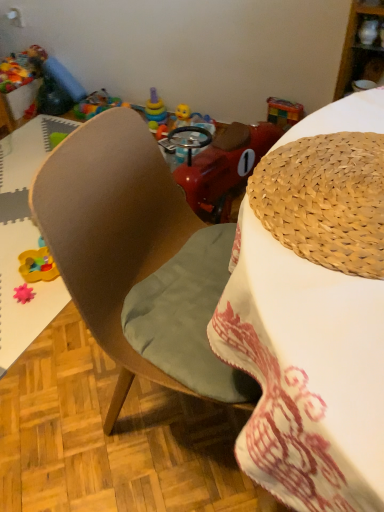
Question: From a real-world perspective, does translucent plastic sippy cup at center, acting as the 1th toy starting from the right, sit lower than woven straw hat at upper right?

Choices:
 (A) yes
 (B) no

Answer: (A)

Question: Does translucent plastic sippy cup at center, the second toy in the top-to-bottom sequence, have a smaller size compared to woven straw hat at upper right?

Choices:
 (A) no
 (B) yes

Answer: (B)

Question: From the image's perspective, is translucent plastic sippy cup at center, positioned as the second toy in front-to-back order, under woven straw hat at upper right?

Choices:
 (A) no
 (B) yes

Answer: (A)

Question: Could woven straw hat at upper right be considered to be inside translucent plastic sippy cup at center, the second toy in the top-to-bottom sequence?

Choices:
 (A) no
 (B) yes

Answer: (A)

Question: From a real-world perspective, is translucent plastic sippy cup at center, the second toy in the top-to-bottom sequence, located higher than woven straw hat at upper right?

Choices:
 (A) yes
 (B) no

Answer: (B)

Question: Is translucent plastic sippy cup at center, positioned as the second toy in front-to-back order, outside of woven straw hat at upper right?

Choices:
 (A) no
 (B) yes

Answer: (B)

Question: From a real-world perspective, is translucent plastic sippy cup at center, the second toy in the top-to-bottom sequence, physically below wooden cabinet at upper right?

Choices:
 (A) no
 (B) yes

Answer: (B)

Question: From the image's perspective, does translucent plastic sippy cup at center, the second toy in the top-to-bottom sequence, appear higher than wooden cabinet at upper right?

Choices:
 (A) yes
 (B) no

Answer: (B)

Question: Is translucent plastic sippy cup at center, positioned as the second toy in front-to-back order, smaller than wooden cabinet at upper right?

Choices:
 (A) yes
 (B) no

Answer: (A)

Question: Can you confirm if translucent plastic sippy cup at center, positioned as the second toy in front-to-back order, is bigger than wooden cabinet at upper right?

Choices:
 (A) yes
 (B) no

Answer: (B)

Question: Is wooden cabinet at upper right a part of translucent plastic sippy cup at center, which is the second toy from bottom to top?

Choices:
 (A) no
 (B) yes

Answer: (A)

Question: Are translucent plastic sippy cup at center, acting as the 1th toy starting from the right, and wooden cabinet at upper right located far from each other?

Choices:
 (A) no
 (B) yes

Answer: (A)

Question: Does rubberized plastic toy at upper left, which ranks as the second toy in left-to-right order, appear on the left side of translucent plastic sippy cup at center, which is the second toy from bottom to top?

Choices:
 (A) yes
 (B) no

Answer: (A)